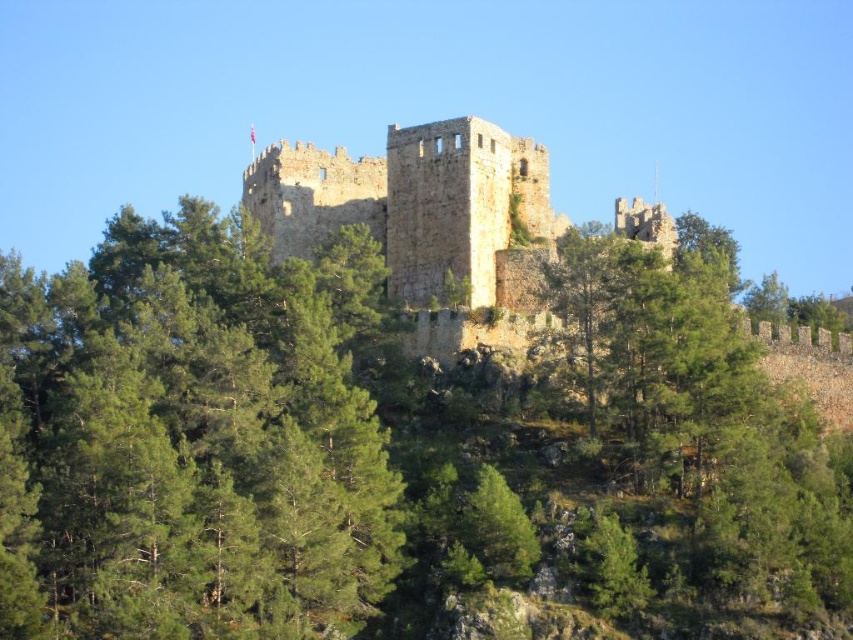
Who is shorter, green leafy tree at center or brown stone castle at center?

brown stone castle at center

The width and height of the screenshot is (853, 640). What are the coordinates of `green leafy tree at center` in the screenshot? It's located at (189, 440).